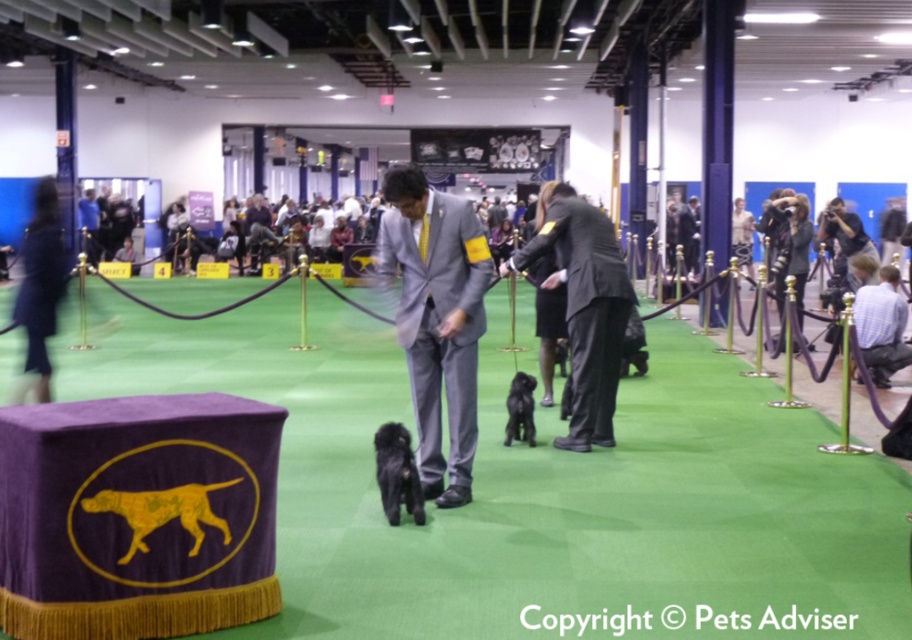
Looking at this image, measure the distance from dark gray suit at center to white shirt at lower right.

dark gray suit at center is 3.53 meters from white shirt at lower right.

Between point (574, 266) and point (890, 337), which one is positioned behind?

The point (890, 337) is more distant.

The height and width of the screenshot is (640, 912). Describe the element at coordinates (584, 307) in the screenshot. I see `dark gray suit at center` at that location.

Where is `dark gray suit at center`? This screenshot has width=912, height=640. dark gray suit at center is located at coordinates (584, 307).

From the picture: Between gray suit at center and black fuzzy dog at center, which one is positioned lower?

black fuzzy dog at center is below.

Does point (480, 301) lie in front of point (405, 500)?

No, it is not.

The image size is (912, 640). In order to click on gray suit at center in this screenshot , I will do `click(436, 317)`.

Is white shirt at lower right shorter than black silky dog at center?

No, white shirt at lower right is not shorter than black silky dog at center.

Is white shirt at lower right closer to the viewer compared to black silky dog at center?

No.

Identify the location of white shirt at lower right. pos(881,326).